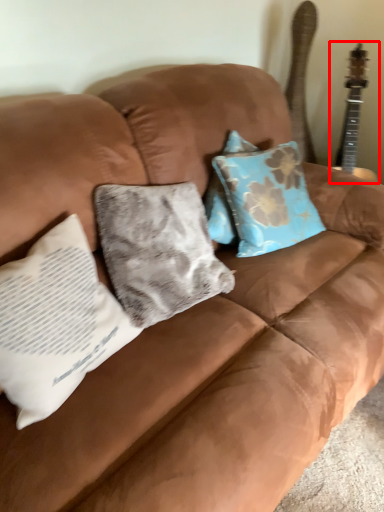
Question: From the image's perspective, what is the correct spatial positioning of guitar (annotated by the red box) in reference to pillow?

Choices:
 (A) below
 (B) above

Answer: (B)